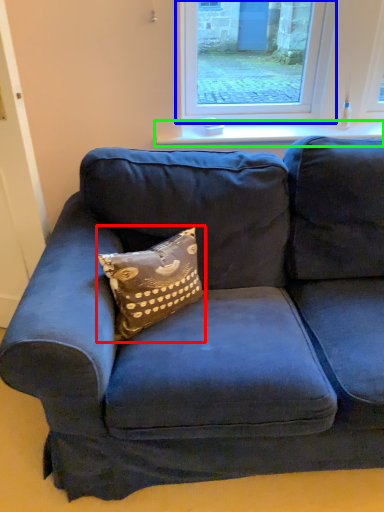
Question: Which is farther away from pillow (highlighted by a red box)? window (highlighted by a blue box) or window sill (highlighted by a green box)?

Choices:
 (A) window
 (B) window sill

Answer: (A)